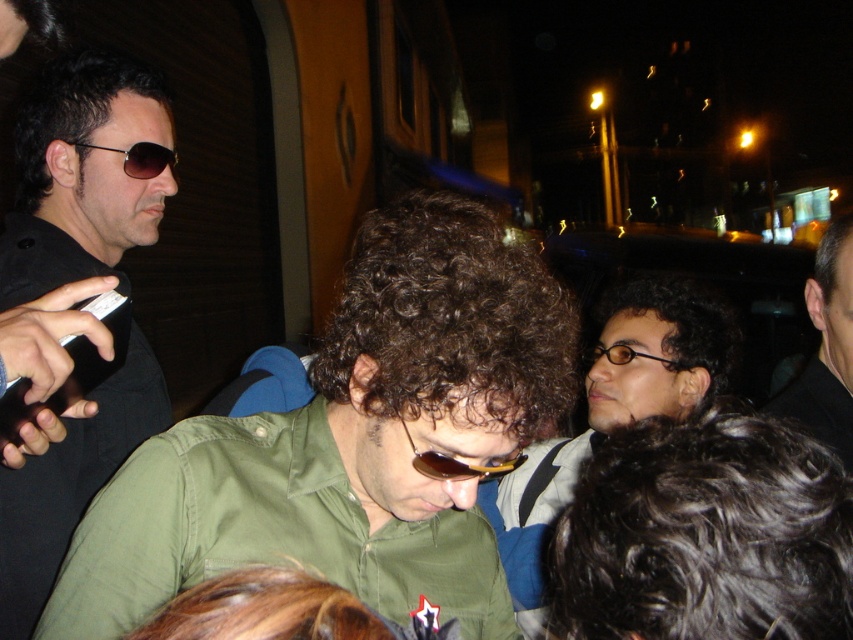
Question: Which object appears closest to the camera in this image?

Choices:
 (A) matte black sunglasses at upper left
 (B) black matte sunglasses at upper left
 (C) sunglasses at center

Answer: (C)

Question: Is green matte shirt at center thinner than matte black sunglasses at upper left?

Choices:
 (A) no
 (B) yes

Answer: (A)

Question: Is matte black hair at center smaller than sunglasses at center?

Choices:
 (A) no
 (B) yes

Answer: (A)

Question: Can you confirm if sunglasses at center is positioned below black plastic glasses at center?

Choices:
 (A) yes
 (B) no

Answer: (A)

Question: Among these points, which one is farthest from the camera?

Choices:
 (A) (584, 449)
 (B) (471, 472)
 (C) (651, 355)

Answer: (A)

Question: Estimate the real-world distances between objects in this image. Which object is farther from the black matte sunglasses at right?

Choices:
 (A) black matte sunglasses at upper left
 (B) green matte shirt at center
 (C) sunglasses at center
 (D) black plastic glasses at center

Answer: (A)